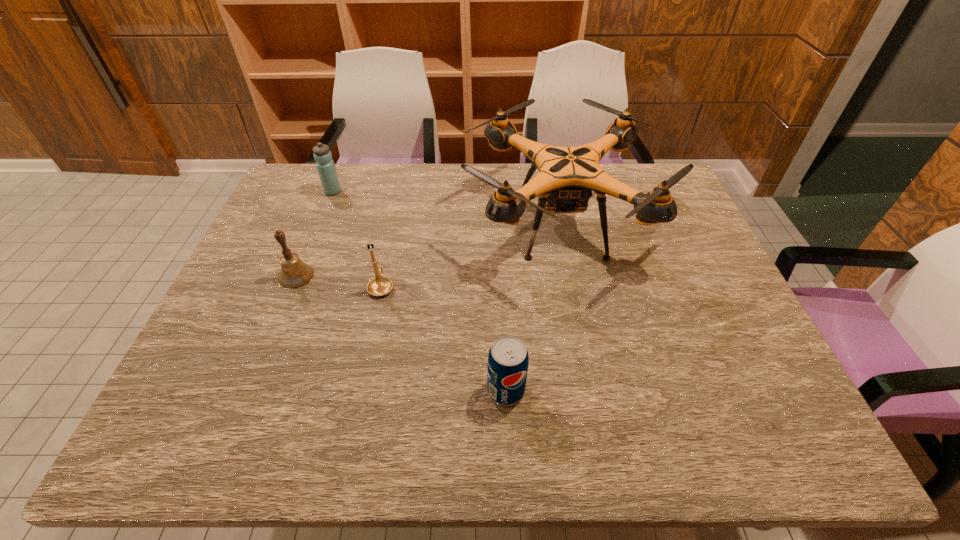
I want to click on free spot located 0.190m on the handle side of the candle holder, so click(394, 230).

You are a GUI agent. You are given a task and a screenshot of the screen. Output one action in this format:
    pyautogui.click(x=<x>, y=<y>)
    Task: Click on the vacant area situated on the handle side of the candle holder
    Image resolution: width=960 pixels, height=540 pixels.
    Given the screenshot: What is the action you would take?
    pyautogui.click(x=389, y=253)

Locate an element on the screen. This screenshot has width=960, height=540. vacant space located on the handle side of the candle holder is located at coordinates (393, 232).

Locate an element on the screen. vacant position located 0.280m on the left of the pop is located at coordinates (357, 390).

The image size is (960, 540). I want to click on drone that is at the far edge, so click(x=567, y=176).

Where is `water bottle at the far edge`? The image size is (960, 540). water bottle at the far edge is located at coordinates (325, 165).

What are the coordinates of `water bottle present at the left edge` in the screenshot? It's located at (325, 165).

Where is `bell located in the left edge section of the desktop`? This screenshot has width=960, height=540. bell located in the left edge section of the desktop is located at coordinates (294, 273).

Find the location of `object that is positioned at the right edge`. object that is positioned at the right edge is located at coordinates (567, 176).

Find the location of a particular element. Image resolution: width=960 pixels, height=540 pixels. object located in the far left corner section of the desktop is located at coordinates pos(325,165).